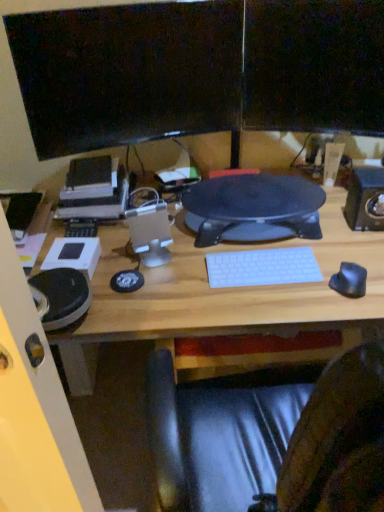
The image size is (384, 512). Describe the element at coordinates (262, 267) in the screenshot. I see `white plastic keyboard at center` at that location.

What do you see at coordinates (253, 208) in the screenshot? The image size is (384, 512). I see `black textured mouse pad at center` at bounding box center [253, 208].

Where is `satin silver speaker at center, the 2th speaker when ordered from right to left`? This screenshot has height=512, width=384. satin silver speaker at center, the 2th speaker when ordered from right to left is located at coordinates (150, 233).

The height and width of the screenshot is (512, 384). Describe the element at coordinates (225, 303) in the screenshot. I see `white plastic keyboard at center` at that location.

How much space does black glossy monitor at upper center, the second computer monitor when ordered from right to left, occupy horizontally?

black glossy monitor at upper center, the second computer monitor when ordered from right to left, is 1.65 inches in width.

The height and width of the screenshot is (512, 384). I want to click on white plastic keyboard at center, so click(262, 267).

Is white plastic keyboard at center spatially inside matte black monitor at upper center, the second computer monitor when ordered from left to right, or outside of it?

white plastic keyboard at center is outside matte black monitor at upper center, the second computer monitor when ordered from left to right.

From a real-world perspective, is white plastic keyboard at center above or below matte black monitor at upper center, the second computer monitor when ordered from left to right?

In terms of real-world spatial position, white plastic keyboard at center is below matte black monitor at upper center, the second computer monitor when ordered from left to right.

Is point (322, 273) more distant than point (319, 96)?

No, (322, 273) is closer to viewer.

Based on the photo, considering the positions of objects white plastic keyboard at center and matte black monitor at upper center, the 1th computer monitor in the right-to-left sequence, in the image provided, who is behind, white plastic keyboard at center or matte black monitor at upper center, the 1th computer monitor in the right-to-left sequence,?

matte black monitor at upper center, the 1th computer monitor in the right-to-left sequence, is further away from the camera.

Is black plastic speaker at right, marked as the 2th speaker in a left-to-right arrangement, located within white plastic keyboard at center?

No.

From the image's perspective, which one is positioned lower, white plastic keyboard at center or black plastic speaker at right, marked as the 2th speaker in a left-to-right arrangement?

white plastic keyboard at center, from the image's perspective.

Does white plastic keyboard at center appear on the left side of black plastic speaker at right, the 1th speaker from the right?

Yes, white plastic keyboard at center is to the left of black plastic speaker at right, the 1th speaker from the right.

In the scene shown: From a real-world perspective, is white plastic keyboard at center under black plastic speaker at right, the 1th speaker from the right?

Indeed, from a real-world perspective, white plastic keyboard at center is positioned beneath black plastic speaker at right, the 1th speaker from the right.

Is satin silver speaker at center, the first speaker viewed from the left, inside matte black monitor at upper center, the second computer monitor when ordered from left to right?

No, satin silver speaker at center, the first speaker viewed from the left, is not inside matte black monitor at upper center, the second computer monitor when ordered from left to right.

Based on the photo, considering the sizes of objects matte black monitor at upper center, the 1th computer monitor in the right-to-left sequence, and satin silver speaker at center, the first speaker viewed from the left, in the image provided, who is bigger, matte black monitor at upper center, the 1th computer monitor in the right-to-left sequence, or satin silver speaker at center, the first speaker viewed from the left,?

matte black monitor at upper center, the 1th computer monitor in the right-to-left sequence.

Does matte black monitor at upper center, the second computer monitor when ordered from left to right, have a greater width compared to satin silver speaker at center, the first speaker viewed from the left?

No.

From a real-world perspective, count 2nd speakers downward from the matte black monitor at upper center, the second computer monitor when ordered from left to right, and point to it. Please provide its 2D coordinates.

[(150, 233)]

From the image's perspective, is white plastic keyboard at center on top of black textured mouse pad at center?

No, from the image's perspective, white plastic keyboard at center is not over black textured mouse pad at center.

Does white plastic keyboard at center turn towards black textured mouse pad at center?

No, white plastic keyboard at center is not facing towards black textured mouse pad at center.

Is white plastic keyboard at center positioned in front of black textured mouse pad at center?

Yes, white plastic keyboard at center is closer to the viewer.

Would you say white plastic keyboard at center contains black textured mouse pad at center?

Actually, black textured mouse pad at center is outside white plastic keyboard at center.

Can you confirm if black plastic speaker at right, marked as the 2th speaker in a left-to-right arrangement, is smaller than satin silver speaker at center, the first speaker viewed from the left?

Actually, black plastic speaker at right, marked as the 2th speaker in a left-to-right arrangement, might be larger than satin silver speaker at center, the first speaker viewed from the left.

In the scene shown: Does black plastic speaker at right, marked as the 2th speaker in a left-to-right arrangement, have a greater height compared to satin silver speaker at center, the first speaker viewed from the left?

In fact, black plastic speaker at right, marked as the 2th speaker in a left-to-right arrangement, may be shorter than satin silver speaker at center, the first speaker viewed from the left.

Considering the points (380, 213) and (149, 212), which point is behind, point (380, 213) or point (149, 212)?

The point (380, 213) is behind.

Can you confirm if black plastic speaker at right, marked as the 2th speaker in a left-to-right arrangement, is thinner than satin silver speaker at center, the first speaker viewed from the left?

Incorrect, the width of black plastic speaker at right, marked as the 2th speaker in a left-to-right arrangement, is not less than that of satin silver speaker at center, the first speaker viewed from the left.

Considering the relative sizes of white plastic keyboard at center and black plastic speaker at right, marked as the 2th speaker in a left-to-right arrangement, in the image provided, is white plastic keyboard at center bigger than black plastic speaker at right, marked as the 2th speaker in a left-to-right arrangement,?

Correct, white plastic keyboard at center is larger in size than black plastic speaker at right, marked as the 2th speaker in a left-to-right arrangement.

Based on the photo, is white plastic keyboard at center oriented away from black plastic speaker at right, the 1th speaker from the right?

That's not correct — white plastic keyboard at center is not looking away from black plastic speaker at right, the 1th speaker from the right.

Considering the sizes of white plastic keyboard at center and black plastic speaker at right, marked as the 2th speaker in a left-to-right arrangement, in the image, is white plastic keyboard at center taller or shorter than black plastic speaker at right, marked as the 2th speaker in a left-to-right arrangement,?

white plastic keyboard at center is taller than black plastic speaker at right, marked as the 2th speaker in a left-to-right arrangement.

Is white plastic keyboard at center surrounding black plastic speaker at right, marked as the 2th speaker in a left-to-right arrangement?

No.

Can you confirm if white plastic keyboard at center is positioned to the left of satin silver speaker at center, the 2th speaker when ordered from right to left?

In fact, white plastic keyboard at center is to the right of satin silver speaker at center, the 2th speaker when ordered from right to left.

Considering the sizes of objects white plastic keyboard at center and satin silver speaker at center, the 2th speaker when ordered from right to left, in the image provided, who is thinner, white plastic keyboard at center or satin silver speaker at center, the 2th speaker when ordered from right to left,?

Thinner between the two is satin silver speaker at center, the 2th speaker when ordered from right to left.

Is point (246, 275) closer to camera compared to point (168, 219)?

Yes, point (246, 275) is in front of point (168, 219).

Find the location of a particular element. The width and height of the screenshot is (384, 512). the 2nd computer monitor behind the white plastic keyboard at center is located at coordinates (314, 66).

I want to click on computer keyboard below the black plastic speaker at right, marked as the 2th speaker in a left-to-right arrangement (from a real-world perspective), so click(x=262, y=267).

Which object lies further to the anchor point white plastic keyboard at center, satin silver speaker at center, the 2th speaker when ordered from right to left, or black textured mouse pad at center?

Based on the image, satin silver speaker at center, the 2th speaker when ordered from right to left, appears to be further to white plastic keyboard at center.

Looking at the image, which one is located closer to black rubber mouse at right, white plastic keyboard at center or black plastic speaker at right, marked as the 2th speaker in a left-to-right arrangement?

black plastic speaker at right, marked as the 2th speaker in a left-to-right arrangement, is closer to black rubber mouse at right.

Which object lies nearer to the anchor point satin silver speaker at center, the 2th speaker when ordered from right to left, black textured mouse pad at center or white plastic keyboard at center?

black textured mouse pad at center is positioned closer to the anchor satin silver speaker at center, the 2th speaker when ordered from right to left.

Which object lies nearer to the anchor point matte black monitor at upper center, the second computer monitor when ordered from left to right, white plastic keyboard at center or black plastic speaker at right, marked as the 2th speaker in a left-to-right arrangement?

black plastic speaker at right, marked as the 2th speaker in a left-to-right arrangement, is closer to matte black monitor at upper center, the second computer monitor when ordered from left to right.

From the image, which object appears to be nearer to white plastic keyboard at center, satin silver speaker at center, the first speaker viewed from the left, or matte black monitor at upper center, the 1th computer monitor in the right-to-left sequence?

satin silver speaker at center, the first speaker viewed from the left, lies closer to white plastic keyboard at center than the other object.

When comparing their distances from black textured mouse pad at center, does white plastic keyboard at center or matte black monitor at upper center, the 1th computer monitor in the right-to-left sequence, seem closer?

Based on the image, white plastic keyboard at center appears to be nearer to black textured mouse pad at center.

Which object lies nearer to the anchor point matte black monitor at upper center, the second computer monitor when ordered from left to right, black glossy monitor at upper center, the second computer monitor when ordered from right to left, or white plastic keyboard at center?

The object closer to matte black monitor at upper center, the second computer monitor when ordered from left to right, is black glossy monitor at upper center, the second computer monitor when ordered from right to left.

From the image, which object appears to be farther from black rubber mouse at right, black glossy monitor at upper center, the second computer monitor when ordered from right to left, or white plastic keyboard at center?

black glossy monitor at upper center, the second computer monitor when ordered from right to left, is further to black rubber mouse at right.

The image size is (384, 512). What are the coordinates of `mouse between black glossy monitor at upper center, the second computer monitor when ordered from right to left, and white plastic keyboard at center vertically` in the screenshot? It's located at (349, 280).

Find the location of a particular element. mouse between black textured mouse pad at center and black plastic speaker at right, the 1th speaker from the right is located at coordinates (349, 280).

Find the location of a particular element. Image resolution: width=384 pixels, height=512 pixels. computer monitor between satin silver speaker at center, the first speaker viewed from the left, and black plastic speaker at right, the 1th speaker from the right, in the horizontal direction is located at coordinates (314, 66).

Find the location of a particular element. This screenshot has width=384, height=512. speaker located between black glossy monitor at upper center, the second computer monitor when ordered from right to left, and black rubber mouse at right in the left-right direction is located at coordinates [150, 233].